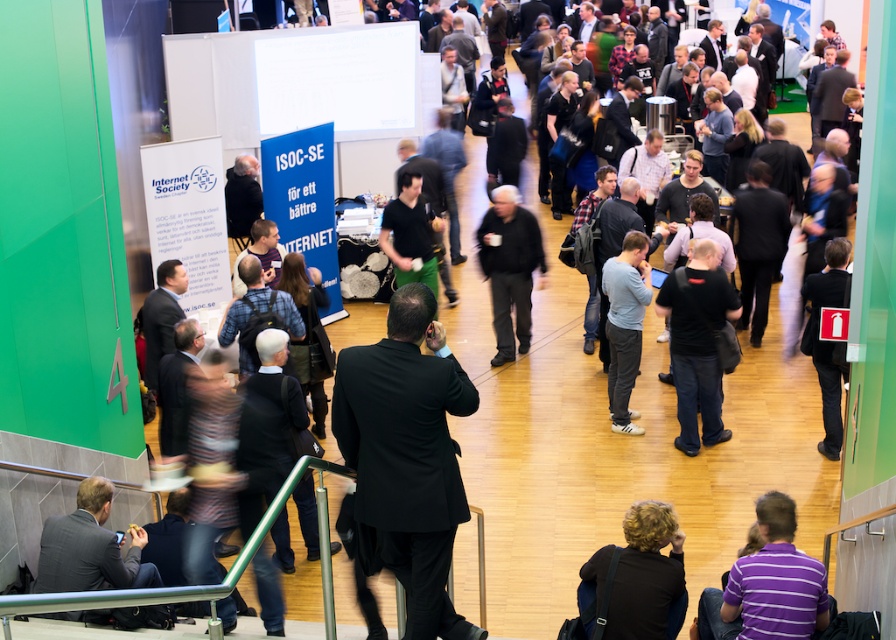
You are a GUI agent. You are given a task and a screenshot of the screen. Output one action in this format:
    pyautogui.click(x=<x>, y=<y>)
    Task: Click on the black suit at center
    
    Given the screenshot: What is the action you would take?
    pyautogui.click(x=406, y=456)

Which is more to the right, black suit at center or gray matte shirt at center?

Positioned to the right is gray matte shirt at center.

Between point (382, 400) and point (636, 250), which one is positioned behind?

Positioned behind is point (636, 250).

Image resolution: width=896 pixels, height=640 pixels. I want to click on black suit at center, so click(x=406, y=456).

Is dark suit at lower left taller than black matte jacket at center?

No, dark suit at lower left is not taller than black matte jacket at center.

Is point (119, 547) closer to viewer compared to point (494, 216)?

Yes, it is.

Image resolution: width=896 pixels, height=640 pixels. What are the coordinates of `dark suit at lower left` in the screenshot? It's located at (90, 547).

Is point (707, 429) farther from viewer compared to point (610, 333)?

No, (707, 429) is in front of (610, 333).

Does point (688, 353) lie in front of point (613, 387)?

That is True.

Find the location of a particular element. black matte shirt at center is located at coordinates (696, 344).